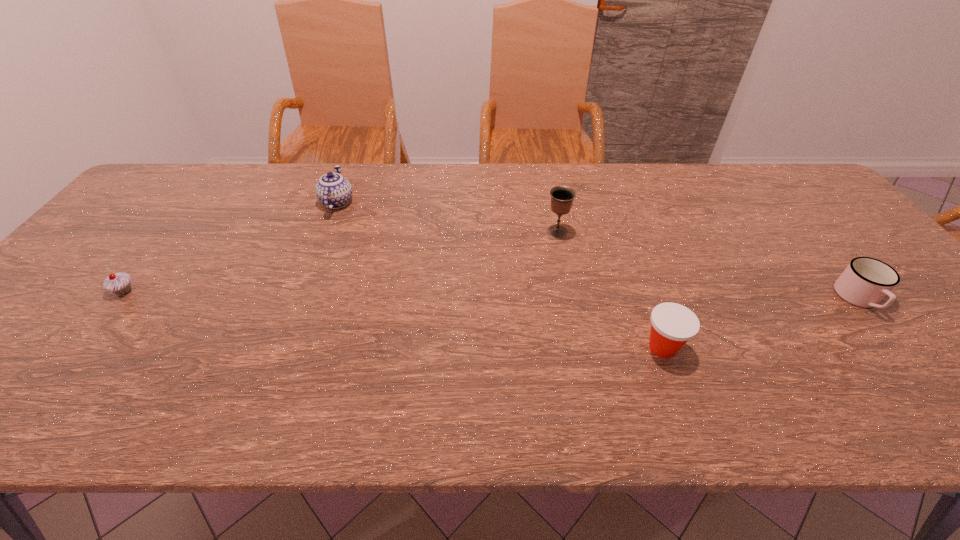
Where is `vacant space in between the chalice and the Dixie cup`? The height and width of the screenshot is (540, 960). vacant space in between the chalice and the Dixie cup is located at coordinates (610, 289).

Locate an element on the screen. empty space that is in between the cupcake and the mug is located at coordinates (492, 295).

This screenshot has width=960, height=540. In order to click on the second closest object to the farthest object in this screenshot , I will do `click(562, 197)`.

Identify which object is located as the third nearest to the Dixie cup. Please provide its 2D coordinates. Your answer should be formatted as a tuple, i.e. [(x, y)], where the tuple contains the x and y coordinates of a point satisfying the conditions above.

[(334, 191)]